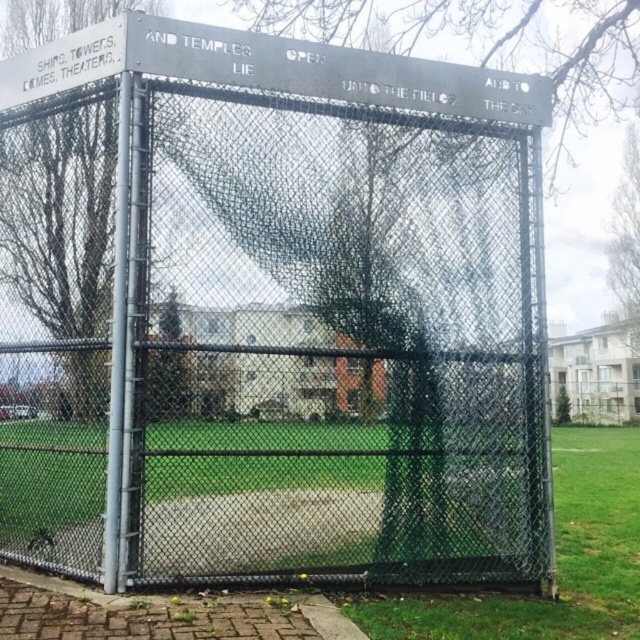
Does green grass at lower center come in front of green grass at lower right?

Yes, green grass at lower center is in front of green grass at lower right.

Does point (618, 428) come closer to viewer compared to point (624, 541)?

No, (618, 428) is further to viewer.

At what (x,y) coordinates should I click in order to perform the action: click on green grass at lower center. Please return your answer as a coordinate pair (x, y). Looking at the image, I should click on (556, 561).

Identify the location of green grass at lower center. (556, 561).